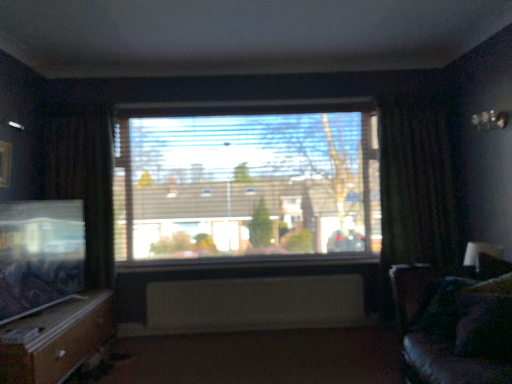
I want to click on empty space that is ontop of white textured radiator at center, so click(x=207, y=282).